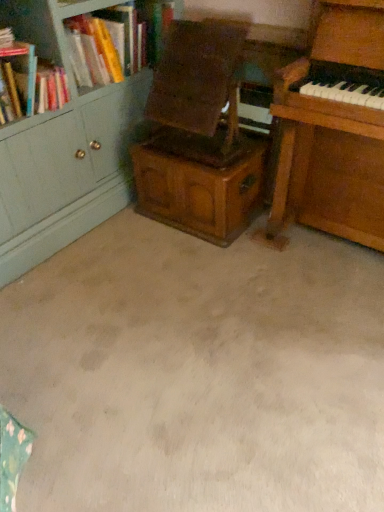
Question: Which is correct: wooden bookcase at upper left is inside wooden armchair at center, or outside of it?

Choices:
 (A) inside
 (B) outside

Answer: (B)

Question: From a real-world perspective, is wooden bookcase at upper left positioned above or below wooden armchair at center?

Choices:
 (A) above
 (B) below

Answer: (A)

Question: Which is farther from the wooden armchair at center?

Choices:
 (A) beige carpet at center
 (B) wooden piano at right
 (C) hardcover book at upper left
 (D) wooden cabinet at center
 (E) wooden bookcase at upper left

Answer: (A)

Question: Estimate the real-world distances between objects in this image. Which object is farther from the wooden cabinet at center?

Choices:
 (A) hardcover book at upper left
 (B) wooden armchair at center
 (C) beige carpet at center
 (D) wooden bookcase at upper left
 (E) wooden piano at right

Answer: (D)